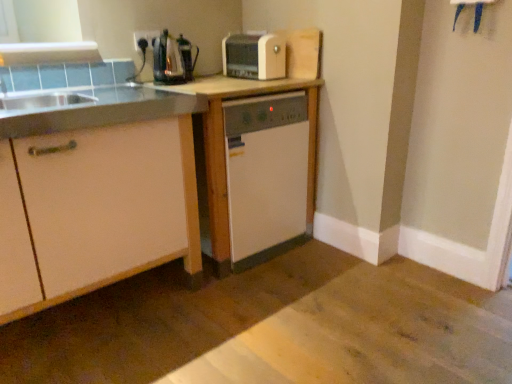
Question: Looking at their shapes, would you say satin silver coffee machine at upper center is wider or thinner than matte plastic outlet at upper left?

Choices:
 (A) wide
 (B) thin

Answer: (A)

Question: Is satin silver coffee machine at upper center bigger or smaller than matte plastic outlet at upper left?

Choices:
 (A) small
 (B) big

Answer: (B)

Question: Estimate the real-world distances between objects in this image. Which object is closer to the white matte cabinet at left?

Choices:
 (A) white wood table at center
 (B) matte plastic outlet at upper left
 (C) white plastic toaster at upper center
 (D) satin silver coffee machine at upper center

Answer: (A)

Question: Which of these objects is positioned closest to the white plastic toaster at upper center?

Choices:
 (A) matte plastic outlet at upper left
 (B) white wood table at center
 (C) satin silver coffee machine at upper center
 (D) white matte cabinet at left

Answer: (C)